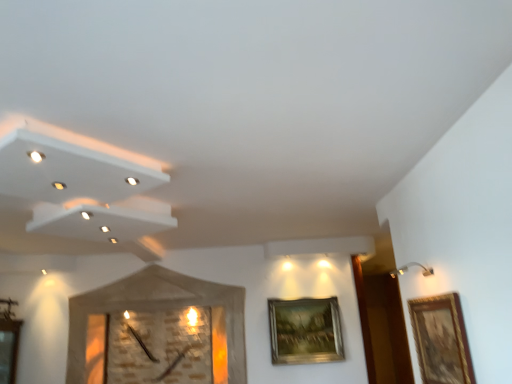
At what (x,y) coordinates should I click in order to perform the action: click on gold metallic picture frame at upper right, the 1th picture frame from the left. Please return your answer as a coordinate pair (x, y). Looking at the image, I should click on (305, 331).

Locate an element on the screen. gold-framed painting at right, the 1th picture frame from the right is located at coordinates (441, 340).

Is gold metallic picture frame at upper right, which is the second picture frame in front-to-back order, facing away from wooden textured clock at center?

gold metallic picture frame at upper right, which is the second picture frame in front-to-back order, is not turned away from wooden textured clock at center.

Find the location of a particular element. This screenshot has width=512, height=384. picture frame that is the 1st one below the wooden textured clock at center (from a real-world perspective) is located at coordinates (305, 331).

How much distance is there between gold metallic picture frame at upper right, which is the second picture frame in front-to-back order, and wooden textured clock at center?

gold metallic picture frame at upper right, which is the second picture frame in front-to-back order, and wooden textured clock at center are 31.62 inches apart.

Between gold metallic picture frame at upper right, the 2th picture frame viewed from the right, and wooden textured clock at center, which one has smaller size?

With smaller size is gold metallic picture frame at upper right, the 2th picture frame viewed from the right.

Which of these two, gold metallic picture frame at upper right, the 2th picture frame viewed from the right, or gold-framed painting at right, the second picture frame from the back, is bigger?

Bigger between the two is gold metallic picture frame at upper right, the 2th picture frame viewed from the right.

Considering the relative sizes of gold metallic picture frame at upper right, positioned as the 2th picture frame in top-to-bottom order, and gold-framed painting at right, the 1th picture frame from the right, in the image provided, is gold metallic picture frame at upper right, positioned as the 2th picture frame in top-to-bottom order, thinner than gold-framed painting at right, the 1th picture frame from the right,?

In fact, gold metallic picture frame at upper right, positioned as the 2th picture frame in top-to-bottom order, might be wider than gold-framed painting at right, the 1th picture frame from the right.

Between gold metallic picture frame at upper right, the 2th picture frame viewed from the right, and gold-framed painting at right, the 1th picture frame positioned from the top, which one has more height?

gold metallic picture frame at upper right, the 2th picture frame viewed from the right, is taller.

From a real-world perspective, which object stands above the other?

gold metallic picture frame at upper right, which is the second picture frame in front-to-back order.

Is gold-framed painting at right, the 1th picture frame from the right, far away from gold metallic picture frame at upper right, marked as the 1th picture frame in a bottom-to-top arrangement?

Yes.

Which is in front, gold-framed painting at right, the second picture frame from the back, or gold metallic picture frame at upper right, which is the second picture frame in front-to-back order?

gold-framed painting at right, the second picture frame from the back, is in front.

From the image's perspective, which one is positioned lower, gold-framed painting at right, the second picture frame from the back, or gold metallic picture frame at upper right, arranged as the first picture frame when viewed from the back?

gold metallic picture frame at upper right, arranged as the first picture frame when viewed from the back.

Could you tell me if wooden textured clock at center is turned towards gold-framed painting at right, the second picture frame ordered from the bottom?

No, wooden textured clock at center is not facing towards gold-framed painting at right, the second picture frame ordered from the bottom.

Image resolution: width=512 pixels, height=384 pixels. Identify the location of picture frame in front of the wooden textured clock at center. (441, 340).

In terms of width, does wooden textured clock at center look wider or thinner when compared to gold-framed painting at right, positioned as the 2th picture frame in left-to-right order?

wooden textured clock at center is wider than gold-framed painting at right, positioned as the 2th picture frame in left-to-right order.

Is wooden textured clock at center far from gold-framed painting at right, positioned as the 2th picture frame in left-to-right order?

Yes.

From the image's perspective, is wooden textured clock at center located beneath gold metallic picture frame at upper right, the 1th picture frame from the left?

Incorrect, from the image's perspective, wooden textured clock at center is higher than gold metallic picture frame at upper right, the 1th picture frame from the left.

The height and width of the screenshot is (384, 512). I want to click on picture frame behind the wooden textured clock at center, so click(305, 331).

Considering the sizes of objects wooden textured clock at center and gold metallic picture frame at upper right, the 2th picture frame viewed from the right, in the image provided, who is bigger, wooden textured clock at center or gold metallic picture frame at upper right, the 2th picture frame viewed from the right,?

Bigger between the two is wooden textured clock at center.

This screenshot has width=512, height=384. Find the location of `clock on the left side of gold-framed painting at right, the second picture frame from the back`. clock on the left side of gold-framed painting at right, the second picture frame from the back is located at coordinates (158, 308).

From the picture: Is gold-framed painting at right, the 1th picture frame from the right, turned away from wooden textured clock at center?

gold-framed painting at right, the 1th picture frame from the right, does not have its back to wooden textured clock at center.

From the image's perspective, would you say gold-framed painting at right, the second picture frame from the back, is shown under wooden textured clock at center?

Incorrect, from the image's perspective, gold-framed painting at right, the second picture frame from the back, is higher than wooden textured clock at center.

Considering the sizes of objects gold-framed painting at right, marked as the 1th picture frame in a front-to-back arrangement, and wooden textured clock at center in the image provided, who is smaller, gold-framed painting at right, marked as the 1th picture frame in a front-to-back arrangement, or wooden textured clock at center?

gold-framed painting at right, marked as the 1th picture frame in a front-to-back arrangement.

The image size is (512, 384). I want to click on picture frame that appears behind the wooden textured clock at center, so click(305, 331).

Locate an element on the screen. The width and height of the screenshot is (512, 384). picture frame located above the gold metallic picture frame at upper right, which is the second picture frame in front-to-back order (from the image's perspective) is located at coordinates click(x=441, y=340).

Considering their positions, is gold metallic picture frame at upper right, the 1th picture frame from the left, positioned further to gold-framed painting at right, the second picture frame ordered from the bottom, than wooden textured clock at center?

wooden textured clock at center is positioned further to the anchor gold-framed painting at right, the second picture frame ordered from the bottom.

Estimate the real-world distances between objects in this image. Which object is further from wooden textured clock at center, gold-framed painting at right, the 1th picture frame from the right, or gold metallic picture frame at upper right, marked as the 1th picture frame in a bottom-to-top arrangement?

The object further to wooden textured clock at center is gold-framed painting at right, the 1th picture frame from the right.

When comparing their distances from wooden textured clock at center, does gold metallic picture frame at upper right, which is the second picture frame in front-to-back order, or gold-framed painting at right, the second picture frame from the back, seem further?

Among the two, gold-framed painting at right, the second picture frame from the back, is located further to wooden textured clock at center.

When comparing their distances from gold metallic picture frame at upper right, positioned as the 2th picture frame in top-to-bottom order, does wooden textured clock at center or gold-framed painting at right, the 1th picture frame positioned from the top, seem further?

Among the two, gold-framed painting at right, the 1th picture frame positioned from the top, is located further to gold metallic picture frame at upper right, positioned as the 2th picture frame in top-to-bottom order.

Based on their spatial positions, is gold-framed painting at right, positioned as the 2th picture frame in left-to-right order, or wooden textured clock at center further from gold metallic picture frame at upper right, marked as the 1th picture frame in a bottom-to-top arrangement?

The object further to gold metallic picture frame at upper right, marked as the 1th picture frame in a bottom-to-top arrangement, is gold-framed painting at right, positioned as the 2th picture frame in left-to-right order.

From the image, which object appears to be farther from gold-framed painting at right, positioned as the 2th picture frame in left-to-right order, wooden textured clock at center or gold metallic picture frame at upper right, marked as the 1th picture frame in a bottom-to-top arrangement?

wooden textured clock at center lies further to gold-framed painting at right, positioned as the 2th picture frame in left-to-right order, than the other object.

You are a GUI agent. You are given a task and a screenshot of the screen. Output one action in this format:
    pyautogui.click(x=<x>, y=<y>)
    Task: Click on the clock between gold-framed painting at right, positioned as the 2th picture frame in left-to-right order, and gold metallic picture frame at upper right, arranged as the first picture frame when viewed from the back, from front to back
    This screenshot has width=512, height=384.
    Given the screenshot: What is the action you would take?
    pyautogui.click(x=158, y=308)